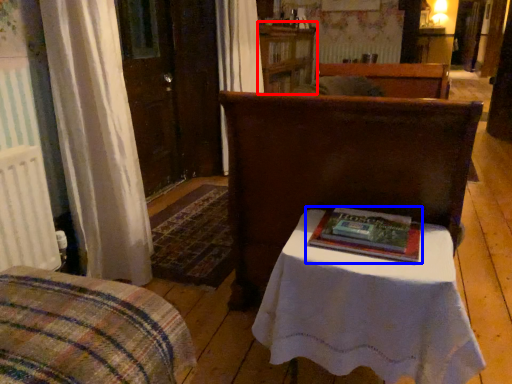
Question: Which object appears farthest to the camera in this image, dresser (highlighted by a red box) or book (highlighted by a blue box)?

Choices:
 (A) dresser
 (B) book

Answer: (A)